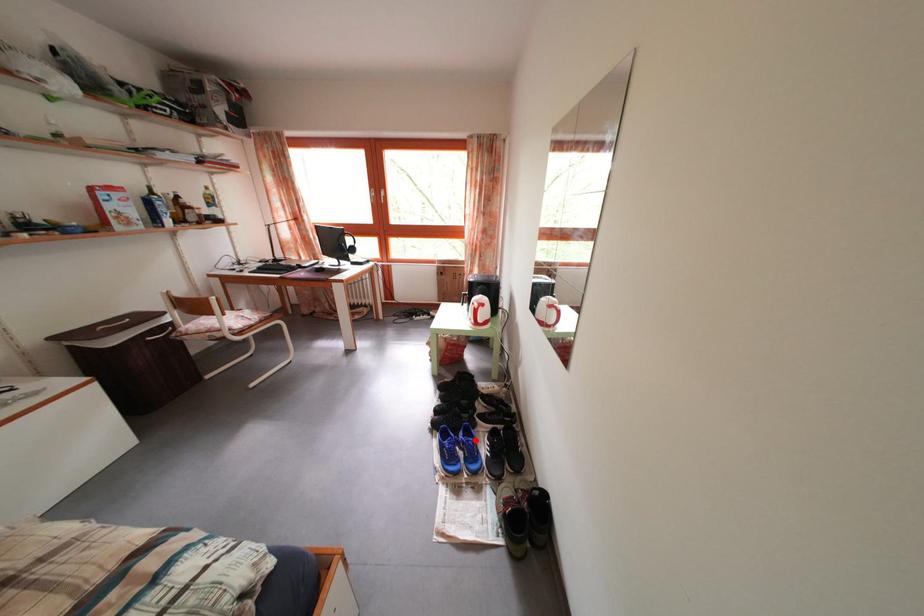
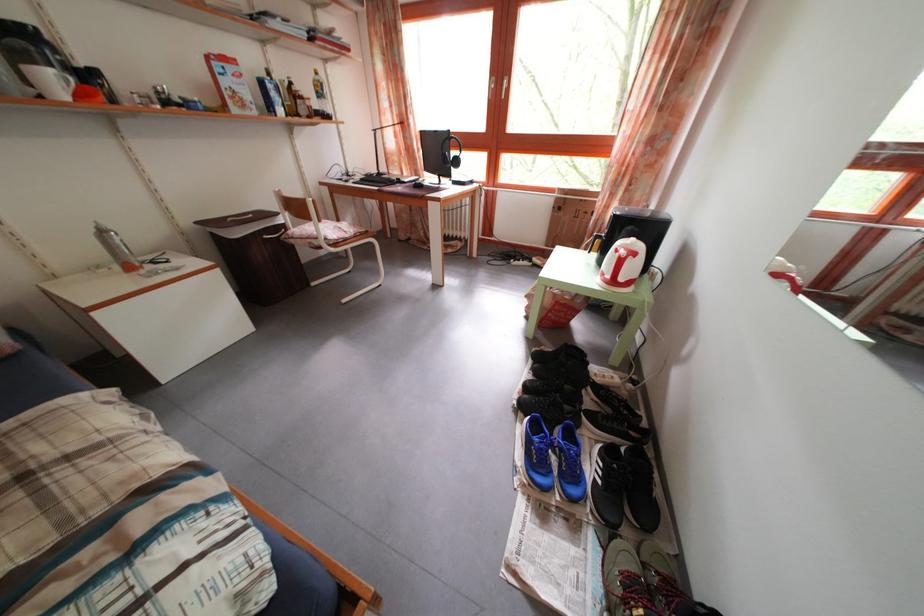
In the second image, find the point that corresponds to the highlighted location in the first image.

(578, 444)